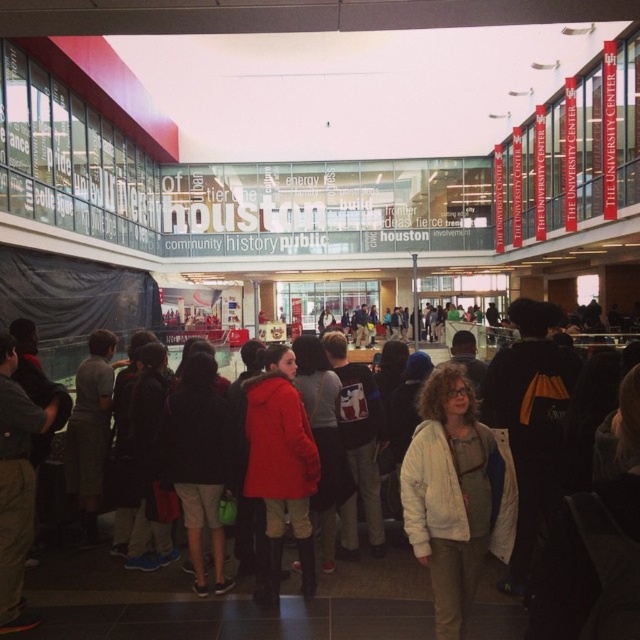
Is white cotton jacket at center wider than red jacket at center?

Yes.

Is white cotton jacket at center below red jacket at center?

Actually, white cotton jacket at center is above red jacket at center.

This screenshot has height=640, width=640. Describe the element at coordinates (454, 493) in the screenshot. I see `white cotton jacket at center` at that location.

This screenshot has height=640, width=640. In order to click on white cotton jacket at center in this screenshot , I will do `click(454, 493)`.

Looking at this image, is matte red coat at center behind red jacket at center?

That is False.

Who is lower down, matte red coat at center or red jacket at center?

red jacket at center is below.

Is point (273, 444) positioned before point (193, 556)?

Yes, point (273, 444) is in front of point (193, 556).

Find the location of a particular element. matte red coat at center is located at coordinates (280, 467).

Can you confirm if white cotton jacket at center is wider than matte red coat at center?

Indeed, white cotton jacket at center has a greater width compared to matte red coat at center.

Can you confirm if white cotton jacket at center is taller than matte red coat at center?

Incorrect, white cotton jacket at center's height is not larger of matte red coat at center's.

Is point (465, 528) positioned in front of point (304, 531)?

Yes.

Locate an element on the screen. This screenshot has width=640, height=640. white cotton jacket at center is located at coordinates (454, 493).